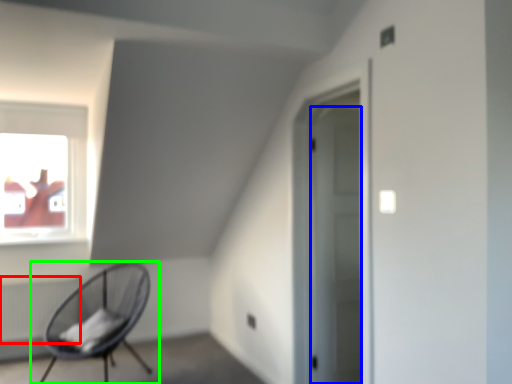
Question: Which object is positioned closest to radiator (highlighted by a red box)? Select from door (highlighted by a blue box) and chair (highlighted by a green box).

Choices:
 (A) door
 (B) chair

Answer: (B)